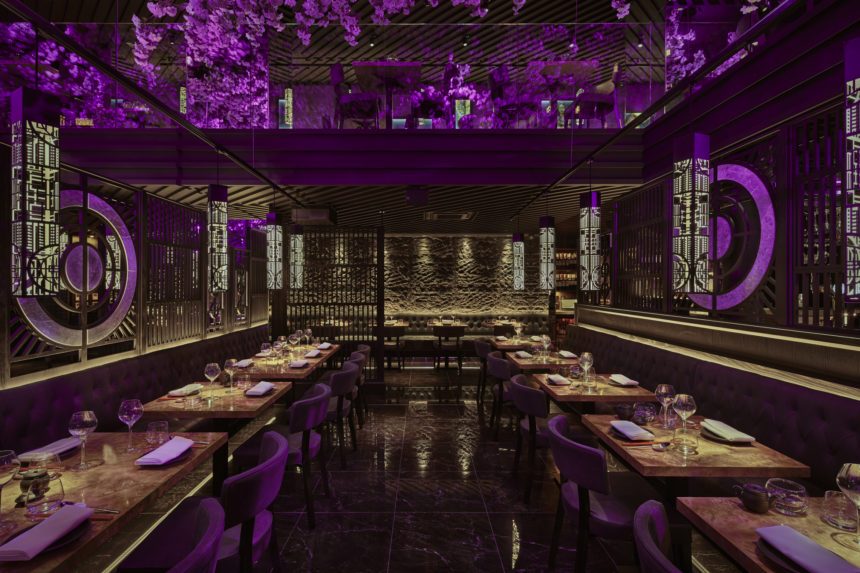
Where is `ceiling`? ceiling is located at coordinates (292, 25).